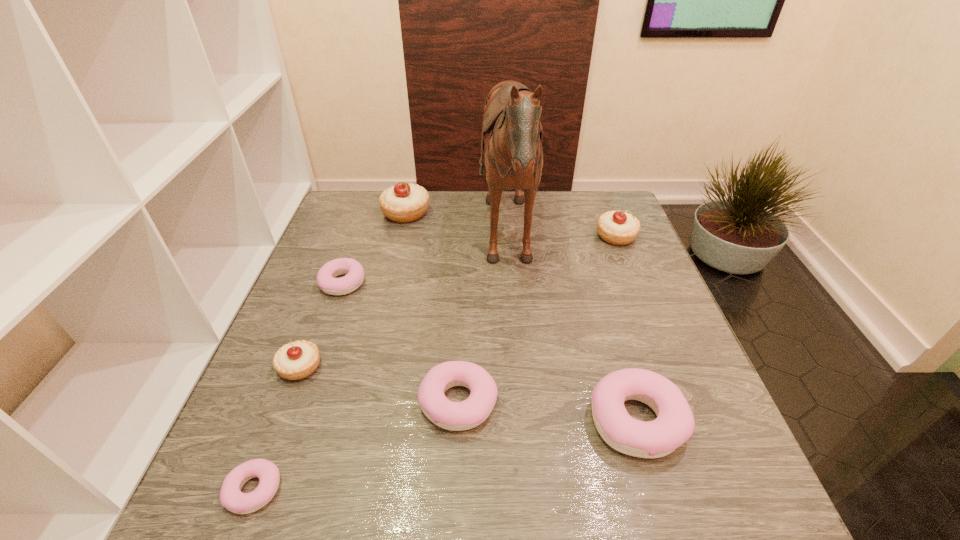
Image resolution: width=960 pixels, height=540 pixels. What are the coordinates of `the fifth pastry from left to right` in the screenshot? It's located at (456, 416).

Where is `the third biggest pink pastry`? the third biggest pink pastry is located at coordinates (354, 273).

Locate an element on the screen. This screenshot has height=540, width=960. the sixth tallest pastry is located at coordinates (354, 273).

Identify the location of the smallest pink pastry. (231, 497).

The height and width of the screenshot is (540, 960). I want to click on the shortest object, so click(x=231, y=497).

Locate an element on the screen. The image size is (960, 540). vacant space located on the back of the tallest object is located at coordinates (351, 244).

At what (x,y) coordinates should I click in order to perform the action: click on vacant point located on the back of the tallest object. Please return your answer as a coordinate pair (x, y). Image resolution: width=960 pixels, height=540 pixels. Looking at the image, I should click on (462, 244).

I want to click on free point located 0.060m on the back of the tallest object, so click(x=458, y=244).

The height and width of the screenshot is (540, 960). What are the coordinates of `vacant position located on the right of the second tallest object` in the screenshot? It's located at (453, 213).

Image resolution: width=960 pixels, height=540 pixels. In order to click on vacant region located 0.100m on the back of the sixth shortest pastry in this screenshot , I will do `click(604, 206)`.